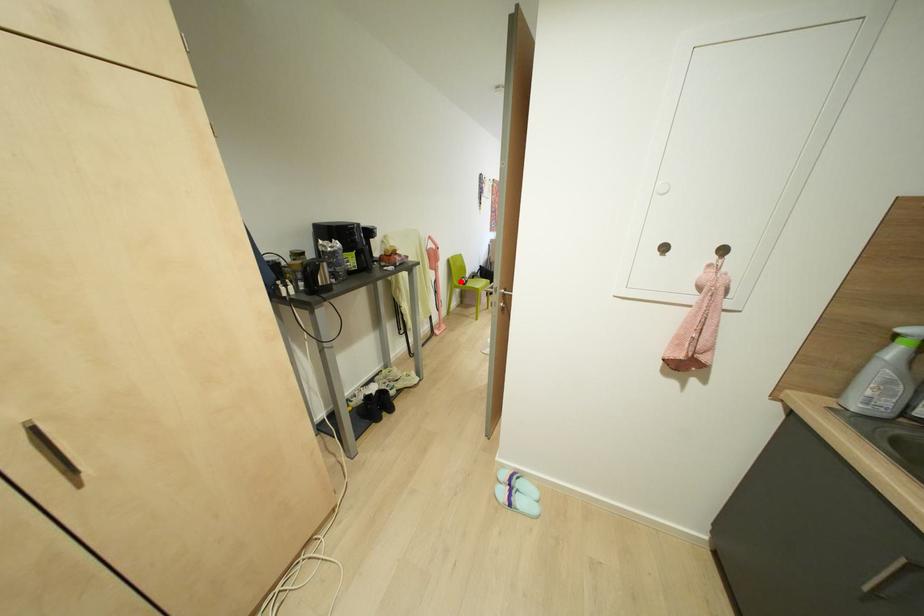
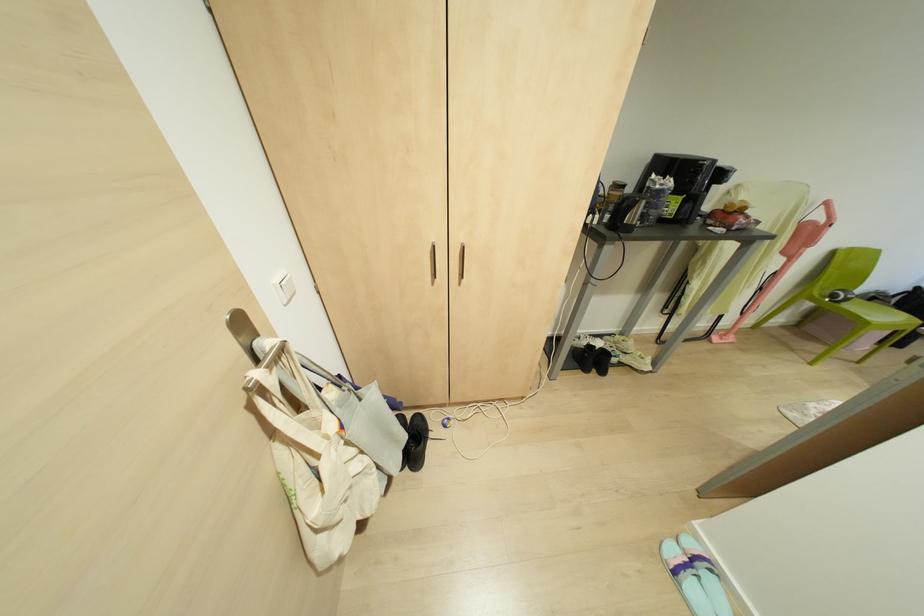
The point at the highlighted location is marked in the first image. Where is the corresponding point in the second image?

(833, 294)